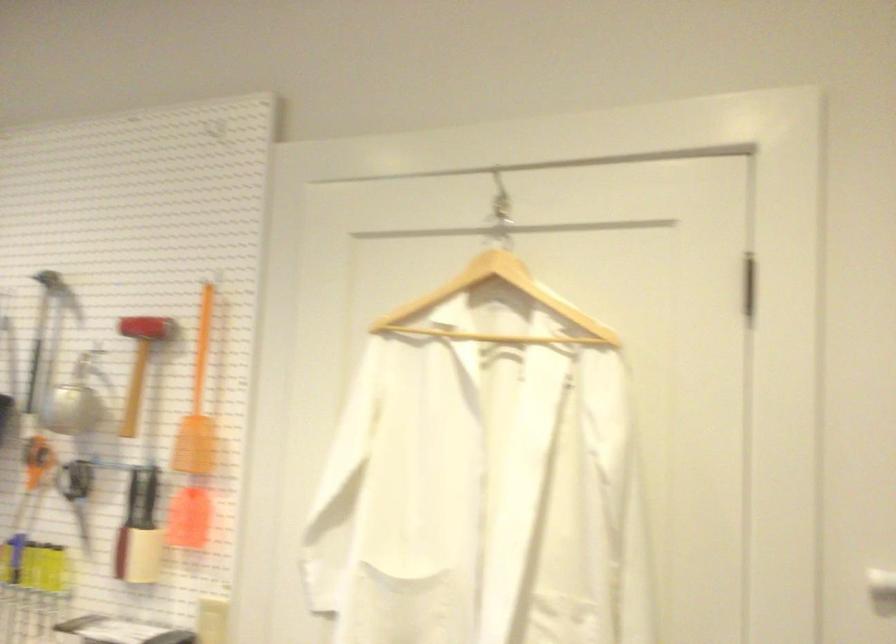
This screenshot has height=644, width=896. Describe the element at coordinates (63, 406) in the screenshot. I see `a watering can handle` at that location.